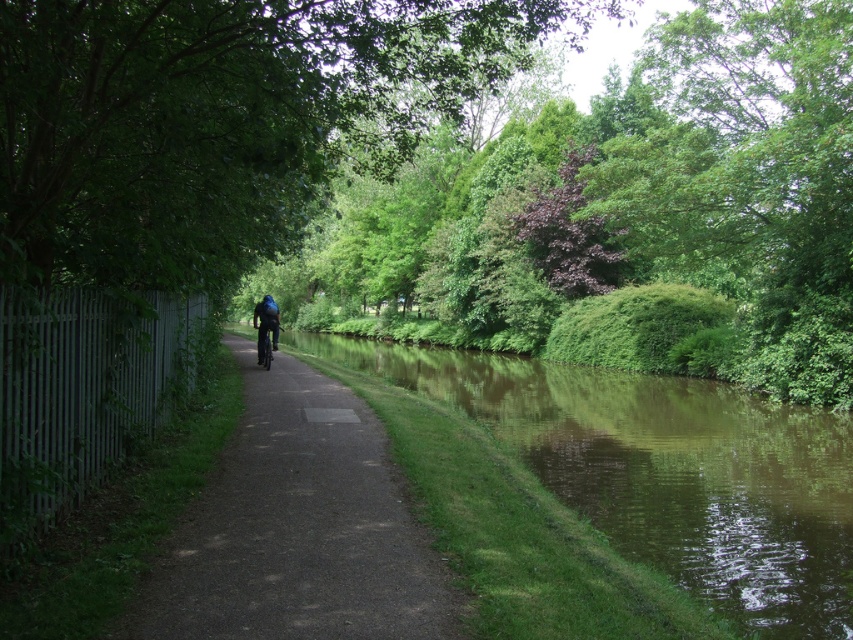
You are a hiker standing on the paved path on the left side of the canal. You want to take a photo of the green leafy tree at center and the green leafy tree at upper center. Which tree is closer to you so that you can capture both in one frame?

The green leafy tree at center is positioned under the green leafy tree at upper center, meaning it is closer to you. To capture both in one frame, you should focus on the green leafy tree at center first as it is nearer, and the green leafy tree at upper center will be in the background.

Consider the image. You are a cyclist planning to ride along the dark asphalt path at center. There is a green leafy tree at upper center that you need to pass under. Will you have enough clearance to avoid hitting the tree? Please provide your answer based on the distance between them.

The green leafy tree at upper center and dark asphalt path at center are 11.29 meters apart from each other. Since the distance is more than sufficient for a cyclist to pass under without hitting the tree, you have enough clearance.

You are standing at point (445, 22) and want to cross the canal to the opposite side. The canal is 10.02 meters wide. If your boat can carry a maximum weight of 120 kg and you weigh 70 kg, how many 5 kg bags of sand can you safely carry across without exceeding the boat capacity?

The boat can carry a maximum of 120 kg. Subtracting your weight of 70 kg leaves 50 kg capacity for the sand bags. Each bag weighs 5 kg, so dividing 50 by 5 gives 10 bags. Therefore, you can safely carry 10 bags of sand.